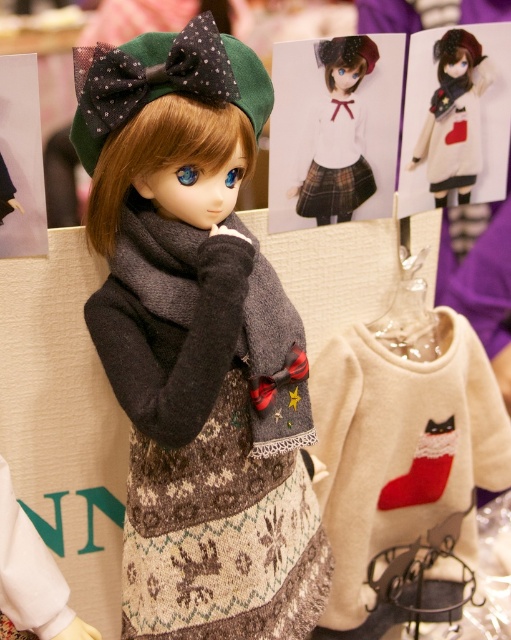
In the scene shown: You are standing in front of a doll display and want to touch the point at coordinates point (229, 276). If your hand can reach up to 30 inches, will you be able to reach it?

The point (229, 276) is 34.45 inches away from the viewer, which is beyond your hand reach of 30 inches. You cannot reach it.

Consider the image. You are trying to decide which item to place on the doll first. The creamy woolen sweater at center and the red felt stocking at lower right are both options. Based on their sizes, which item would you put on first?

The creamy woolen sweater at center has a larger width than the red felt stocking at lower right. Therefore, you should put on the creamy woolen sweater at center first to avoid having to adjust the smaller stocking afterward.

You are organizing a winter fashion show for dolls and need to display the knitted wool sweater at center and the creamy woolen sweater at center. According to the image, which sweater is placed higher?

The knitted wool sweater at center is placed higher than the creamy woolen sweater at center.